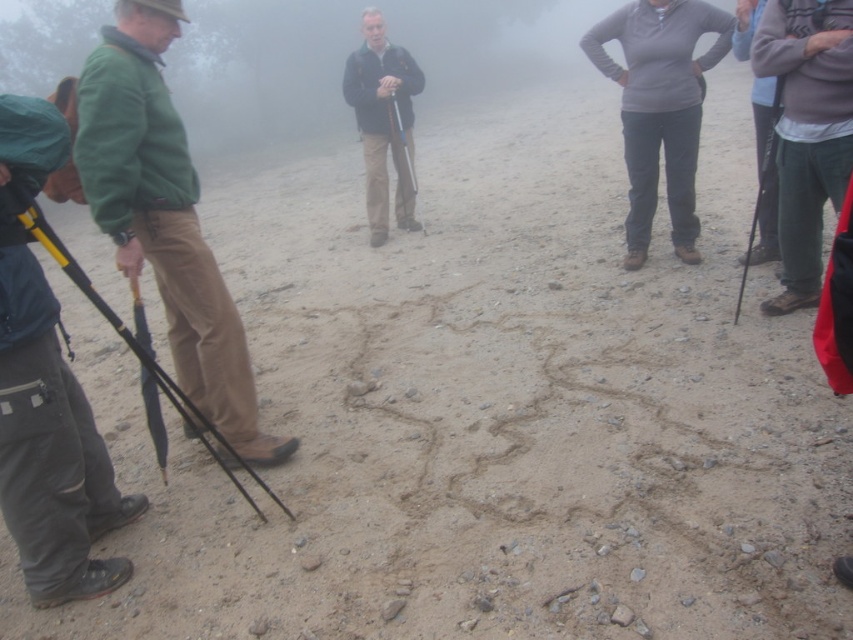
Question: Where is dark gray fleece at upper right located in relation to black rubber umbrella at left in the image?

Choices:
 (A) above
 (B) below

Answer: (A)

Question: Which object is the farthest from the gray matte pants at center?

Choices:
 (A) green fleece jacket at left
 (B) matte black jacket at center
 (C) dark gray fleece at upper right

Answer: (A)

Question: Estimate the real-world distances between objects in this image. Which object is farther from the matte black jacket at center?

Choices:
 (A) dark gray fleece at upper right
 (B) gray matte pants at center

Answer: (A)

Question: Does green fleece jacket at left come behind gray matte pants at center?

Choices:
 (A) no
 (B) yes

Answer: (A)

Question: Is green fleece jacket at left smaller than matte black jacket at center?

Choices:
 (A) yes
 (B) no

Answer: (A)

Question: Which point is farther to the camera?

Choices:
 (A) (369, 157)
 (B) (200, 248)

Answer: (A)